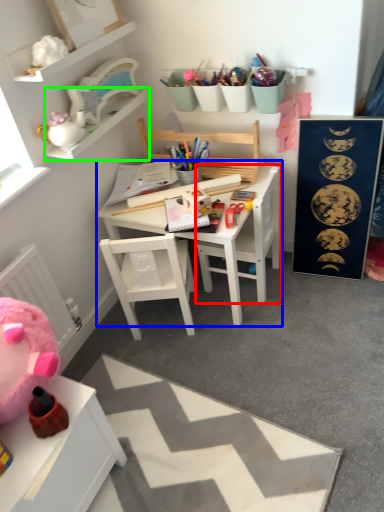
Question: Based on their relative distances, which object is farther from changing table (highlighted by a red box)? Choose from table (highlighted by a blue box) and cabinet (highlighted by a green box).

Choices:
 (A) table
 (B) cabinet

Answer: (B)